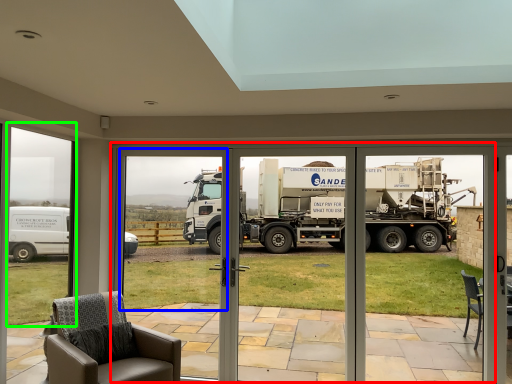
Question: Estimate the real-world distances between objects in this image. Which object is farther from garage door (highlighted by a red box), window screen (highlighted by a blue box) or window frame (highlighted by a green box)?

Choices:
 (A) window screen
 (B) window frame

Answer: (B)